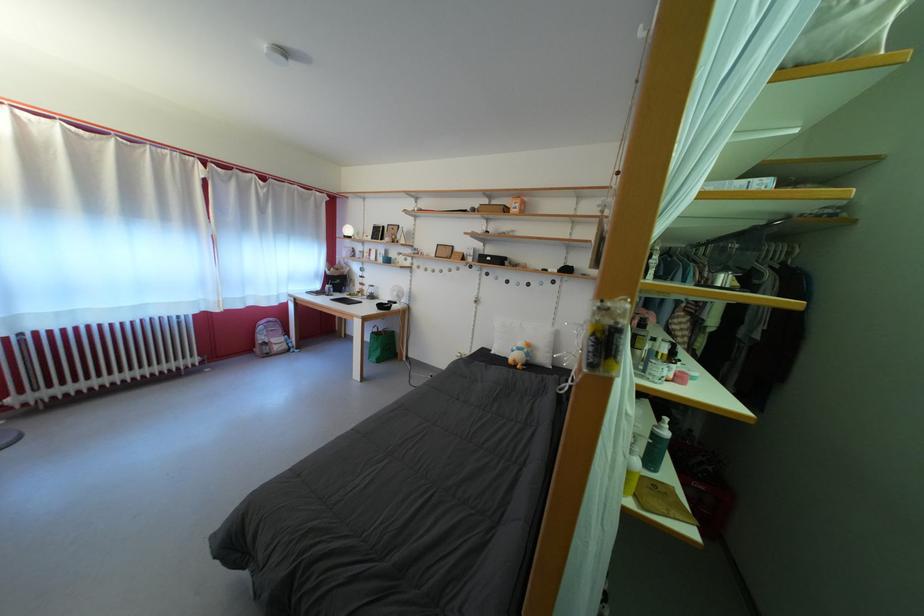
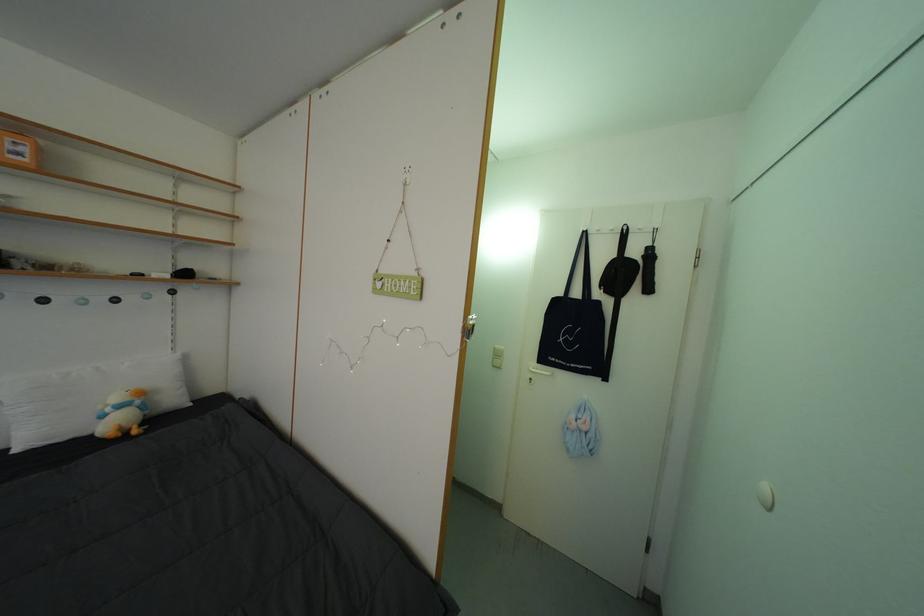
Question: The camera is either moving clockwise (left) or counter-clockwise (right) around the object. The first image is from the beginning of the video and the second image is from the end. Is the camera moving left or right when shooting the video?

Choices:
 (A) Left
 (B) Right

Answer: (A)